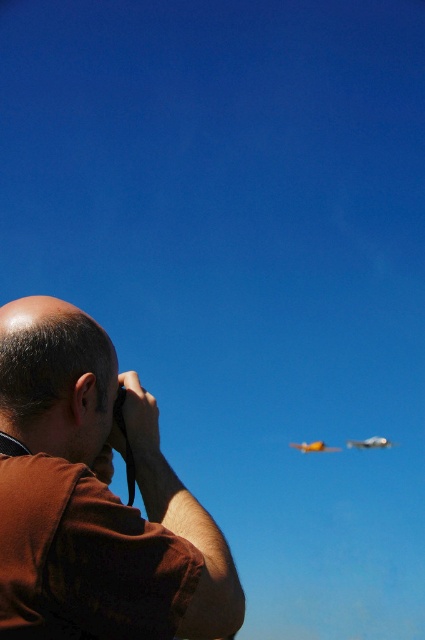
Which is above, brown fabric shirt at left or yellow matte airplane at lower center?

brown fabric shirt at left

Does point (34, 413) come farther from viewer compared to point (348, 444)?

No.

The image size is (425, 640). I want to click on brown fabric shirt at left, so click(x=95, y=499).

Is brown fabric shirt at left shorter than metallic silver airplane at upper right?

No, brown fabric shirt at left is not shorter than metallic silver airplane at upper right.

What do you see at coordinates (95, 499) in the screenshot?
I see `brown fabric shirt at left` at bounding box center [95, 499].

This screenshot has height=640, width=425. Identify the location of brown fabric shirt at left. (95, 499).

Is yellow matte airplane at lower center below metallic silver airplane at upper right?

Incorrect, yellow matte airplane at lower center is not positioned below metallic silver airplane at upper right.

What do you see at coordinates (370, 442) in the screenshot? I see `yellow matte airplane at lower center` at bounding box center [370, 442].

Identify the location of yellow matte airplane at lower center. (370, 442).